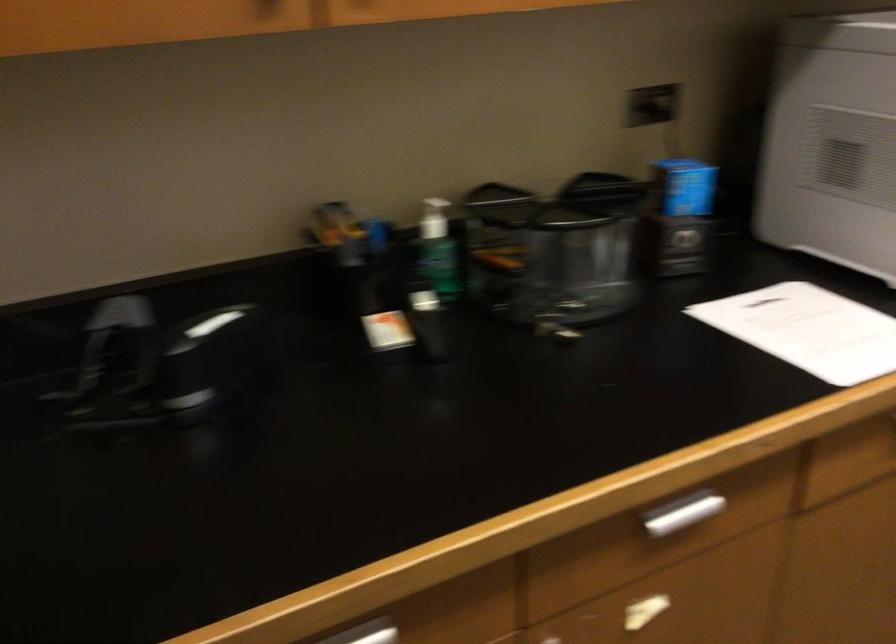
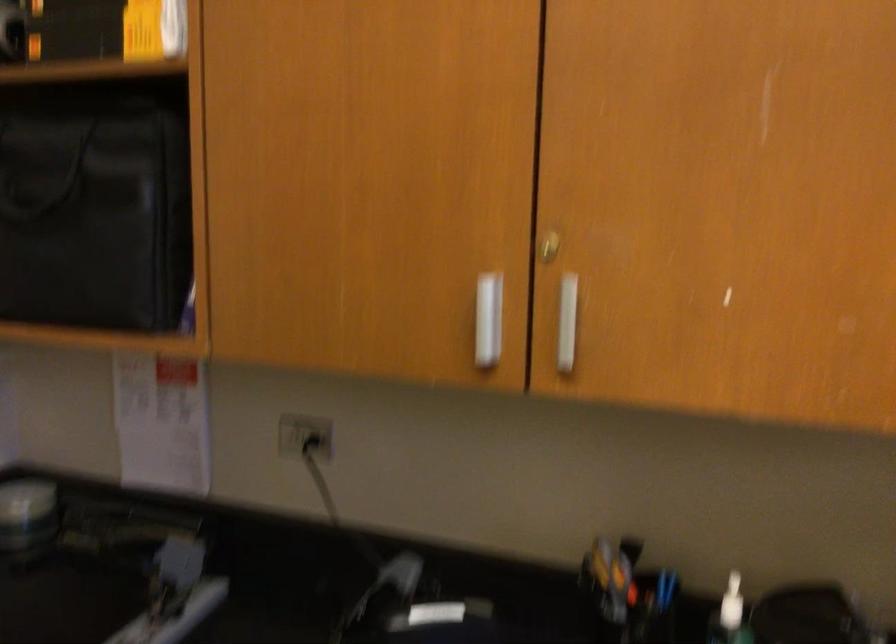
Question: The camera is either moving clockwise (left) or counter-clockwise (right) around the object. The first image is from the beginning of the video and the second image is from the end. Is the camera moving left or right when shooting the video?

Choices:
 (A) Left
 (B) Right

Answer: (B)